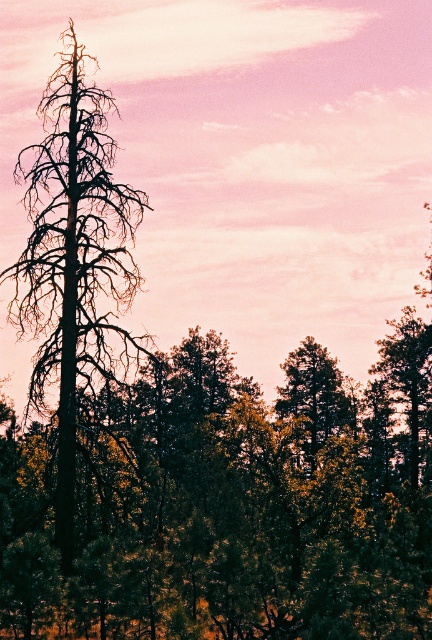
Question: Which point is closer to the camera taking this photo?

Choices:
 (A) (99, 97)
 (B) (298, 408)

Answer: (A)

Question: Can you confirm if dark brown bark tree at left is positioned below green matte tree at center?

Choices:
 (A) no
 (B) yes

Answer: (A)

Question: From the image, what is the correct spatial relationship of dark brown bark tree at left in relation to green matte tree at center?

Choices:
 (A) right
 (B) left

Answer: (B)

Question: Among these points, which one is nearest to the camera?

Choices:
 (A) (294, 404)
 (B) (120, 337)

Answer: (B)

Question: Is dark brown bark tree at left below green matte tree at center?

Choices:
 (A) no
 (B) yes

Answer: (A)